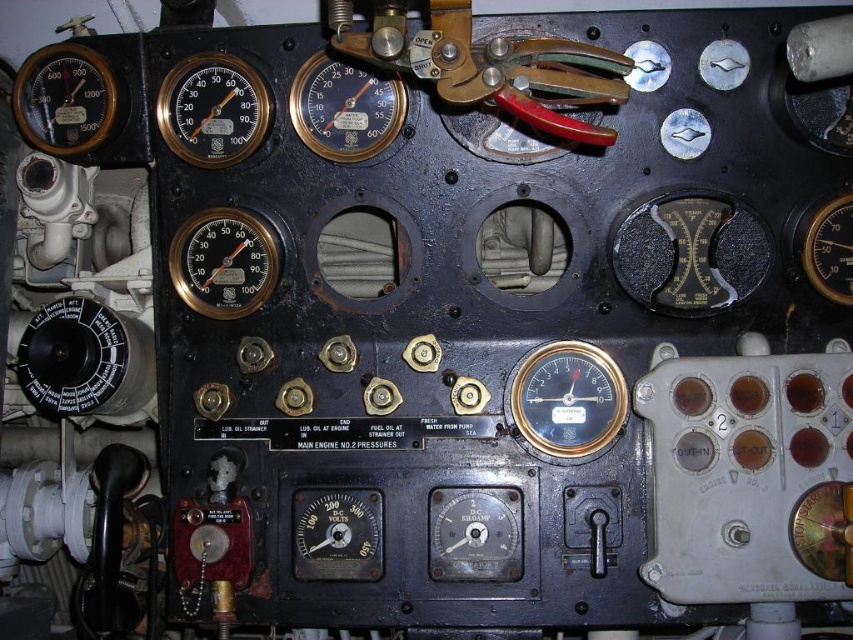
Does matte gold gauge at upper left appear on the right side of matte brass gauge at center-left?

No, matte gold gauge at upper left is not to the right of matte brass gauge at center-left.

Is matte gold gauge at upper left to the left of matte brass gauge at center-left from the viewer's perspective?

Correct, you'll find matte gold gauge at upper left to the left of matte brass gauge at center-left.

Is point (189, 61) positioned before point (277, 273)?

No.

Find the location of a particular element. This screenshot has height=640, width=853. matte gold gauge at upper left is located at coordinates (212, 109).

Who is more forward, (401, 90) or (834, 291)?

Point (834, 291) is in front.

Looking at this image, is matte black gauge at center wider than black metallic gauge at right?

Yes.

Does point (335, 84) come closer to viewer compared to point (843, 259)?

No.

The width and height of the screenshot is (853, 640). Find the location of `matte black gauge at center`. matte black gauge at center is located at coordinates (345, 108).

Who is taller, matte black gauge at center right or matte black gauge at upper left?

With more height is matte black gauge at upper left.

Does matte black gauge at center right have a lesser height compared to matte black gauge at upper left?

Yes.

What do you see at coordinates (567, 397) in the screenshot?
I see `matte black gauge at center right` at bounding box center [567, 397].

Image resolution: width=853 pixels, height=640 pixels. I want to click on matte black gauge at center right, so click(x=567, y=397).